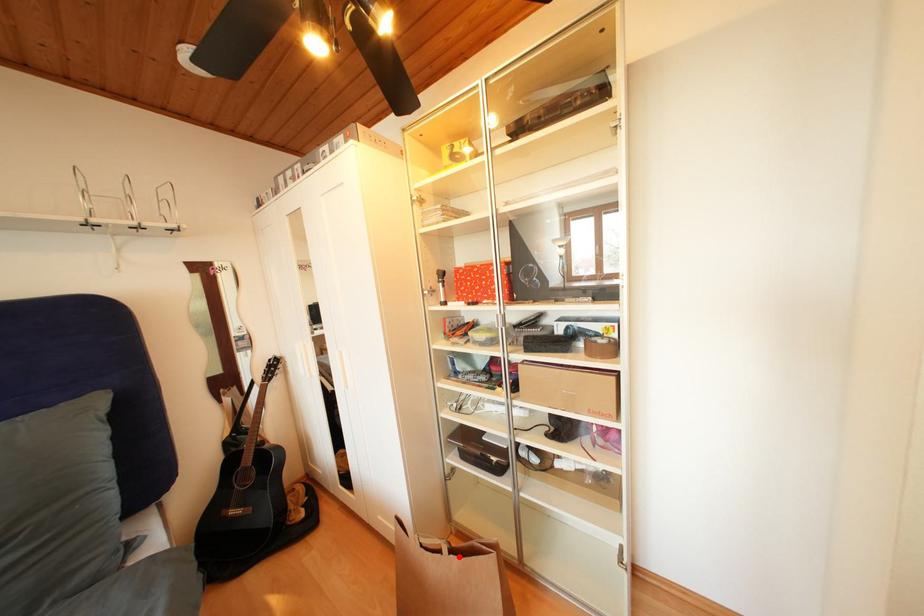
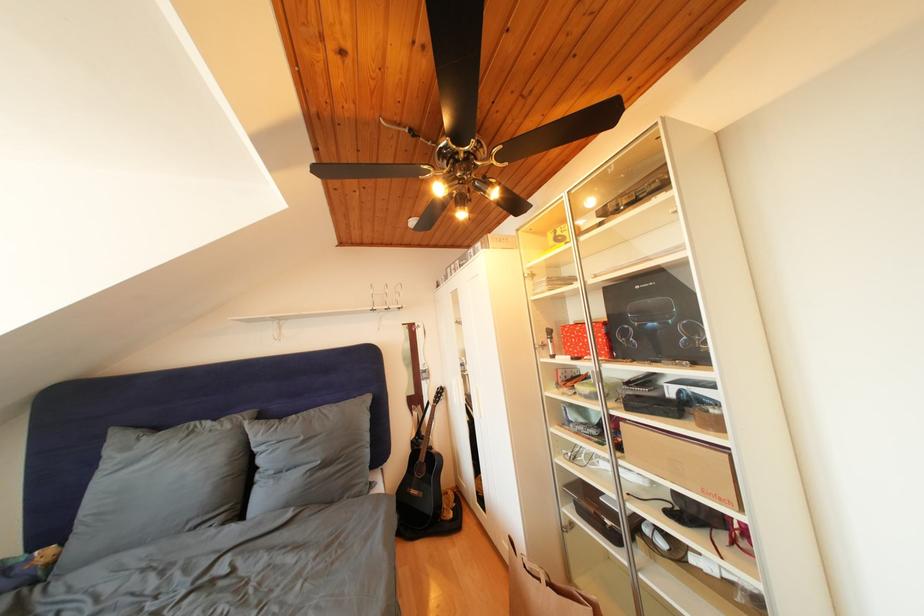
Locate, in the second image, the point that corresponds to the highlighted location in the first image.

(556, 590)